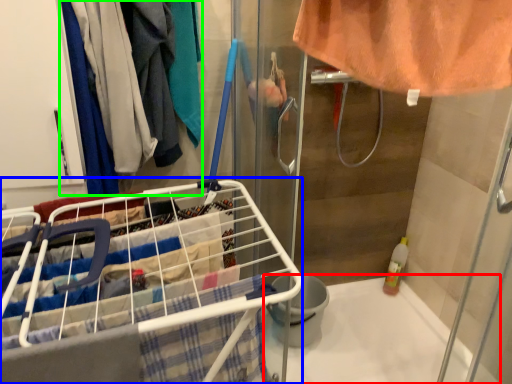
Question: Estimate the real-world distances between objects in this image. Which object is closer to bath (highlighted by a red box), shopping cart (highlighted by a blue box) or clothing (highlighted by a green box)?

Choices:
 (A) shopping cart
 (B) clothing

Answer: (A)